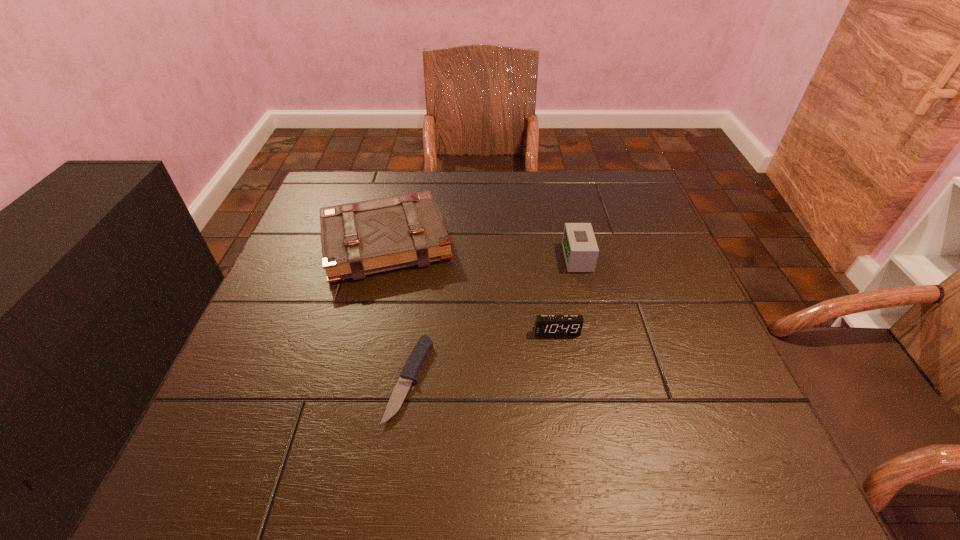
You are a GUI agent. You are given a task and a screenshot of the screen. Output one action in this format:
    pyautogui.click(x=<x>, y=<y>)
    Task: Click on the empty space that is in between the nearest object and the second object from right to left
    
    Given the screenshot: What is the action you would take?
    483,355

Image resolution: width=960 pixels, height=540 pixels. In order to click on object that stands as the second closest to the third object from left to right in this screenshot , I will do `click(417, 357)`.

This screenshot has width=960, height=540. I want to click on object that is the closest to the left alarm clock, so click(x=580, y=248).

This screenshot has height=540, width=960. Identify the location of free spot that satisfies the following two spatial constraints: 1. on the front-facing side of the farther alarm clock; 2. on the front side of the nearest object. click(607, 379).

Where is `free space that satisfies the following two spatial constraints: 1. on the front-facing side of the rightmost object; 2. on the front-facing side of the third farthest object`? The height and width of the screenshot is (540, 960). free space that satisfies the following two spatial constraints: 1. on the front-facing side of the rightmost object; 2. on the front-facing side of the third farthest object is located at coordinates (595, 332).

The height and width of the screenshot is (540, 960). What are the coordinates of `vacant area in the image that satisfies the following two spatial constraints: 1. on the front-facing side of the rightmost object; 2. on the front-facing side of the second nearest object` in the screenshot? It's located at (595, 332).

The height and width of the screenshot is (540, 960). In order to click on vacant point that satisfies the following two spatial constraints: 1. on the front-facing side of the right alarm clock; 2. on the front-facing side of the shorter alarm clock in this screenshot , I will do `click(595, 332)`.